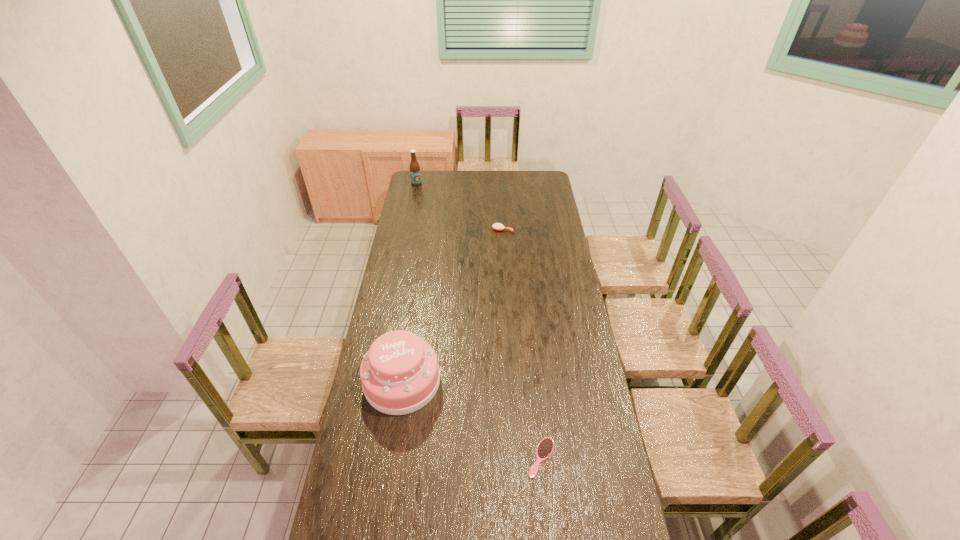
Find the location of a particular element. The image size is (960, 540). beer bottle is located at coordinates (415, 175).

Locate an element on the screen. Image resolution: width=960 pixels, height=540 pixels. the second nearest object is located at coordinates (400, 374).

Where is `birthday cake`? birthday cake is located at coordinates (400, 374).

This screenshot has height=540, width=960. I want to click on the taller hairbrush, so (x=496, y=226).

Image resolution: width=960 pixels, height=540 pixels. Identify the location of the third nearest object. (496, 226).

You are a GUI agent. You are given a task and a screenshot of the screen. Output one action in this format:
    pyautogui.click(x=<x>, y=<y>)
    Task: Click on the nearer hairbrush
    This screenshot has height=540, width=960.
    Given the screenshot: What is the action you would take?
    [x=545, y=448]

I want to click on the nearest object, so click(x=545, y=448).

Locate an element on the screen. This screenshot has height=540, width=960. vacant space situated 0.400m on the front of the beer bottle is located at coordinates (408, 224).

Find the location of `vacant region located on the front of the second tallest object`. vacant region located on the front of the second tallest object is located at coordinates (389, 467).

This screenshot has width=960, height=540. I want to click on vacant space located 0.350m on the back of the taller hairbrush, so click(500, 193).